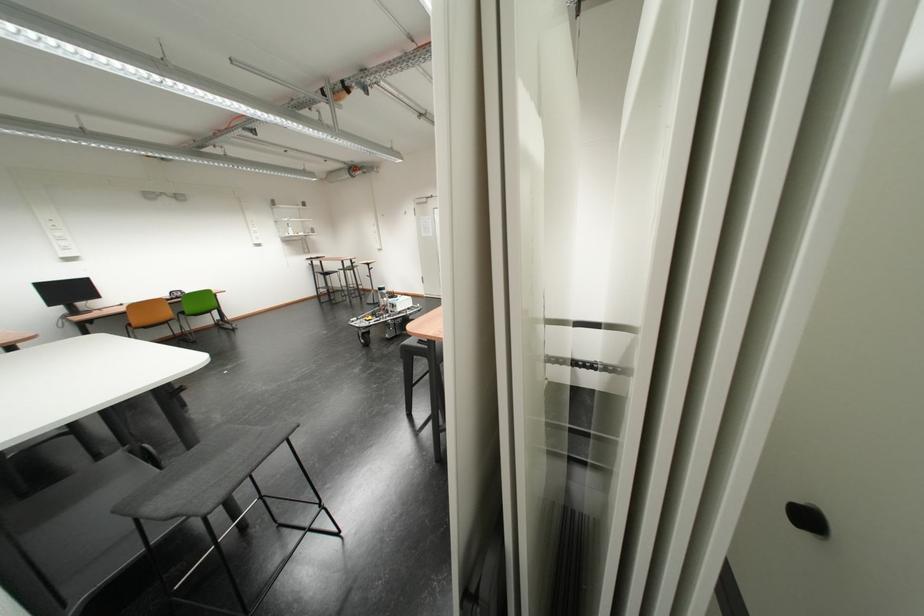
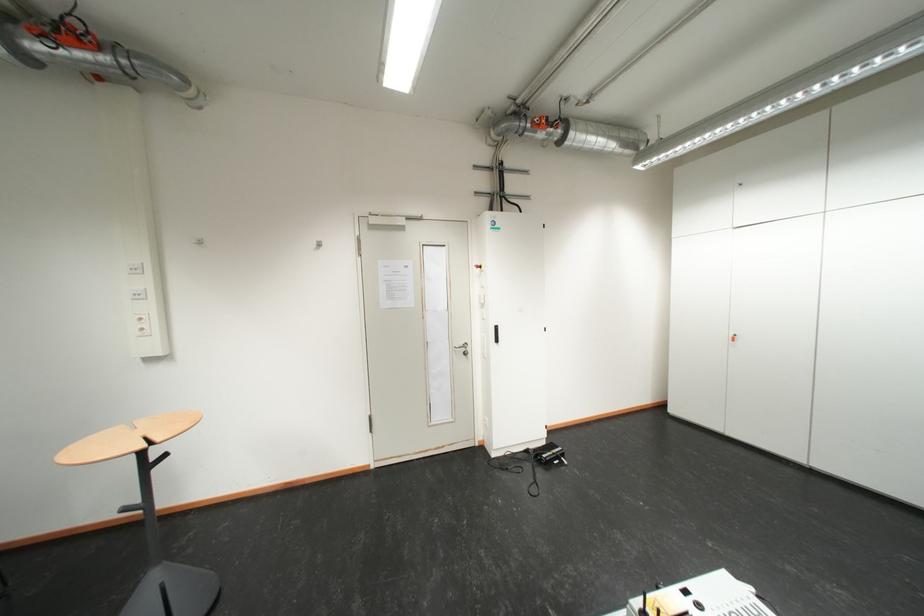
In the second image, find the point that corresponds to the point at 363,179 in the first image.

(35, 60)